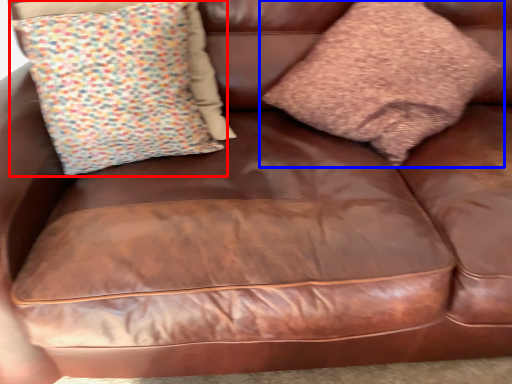
Question: Which object appears closest to the camera in this image, pillow (highlighted by a red box) or pillow (highlighted by a blue box)?

Choices:
 (A) pillow
 (B) pillow

Answer: (B)